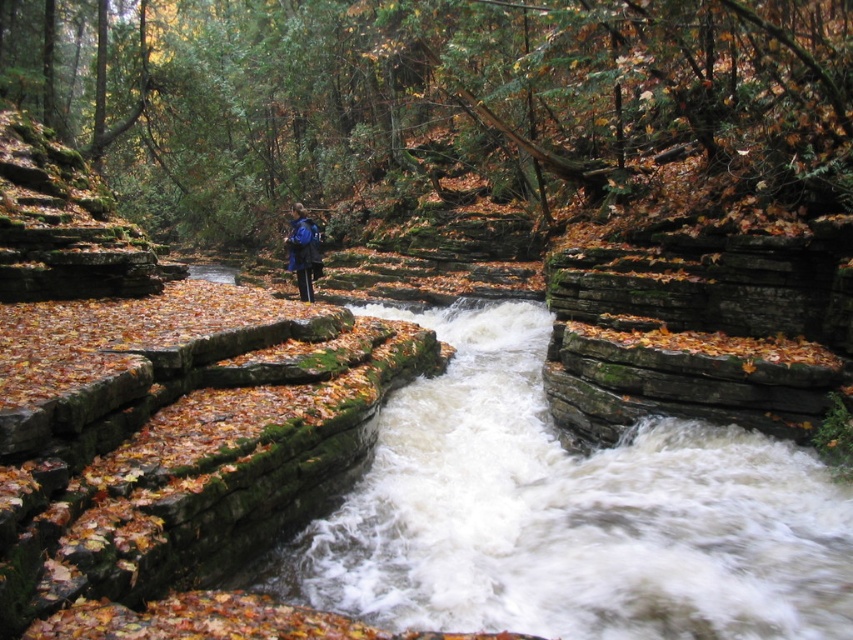
You are standing at the point labeled point (569, 515) in the image. What is the object you are standing on?

The point (569, 515) corresponds to the brown stone stream at center.

You are a hiker trying to cross the stream in the autumn forest scene. You notice two points marked on the stream bed. The first point is at coordinates point [781,506] and the second is at point [308,252]. Which point would be easier to step on first if you are approaching from the top of the image?

Point [781,506] is in front of point [308,252], so it would be easier to step on first as you approach from the top of the image.

You are a hiker who wants to place your blue fabric backpack at center on the ground near the stream. However, you notice there are green mossy rocks at center in the way. Based on the scene, can you place the backpack directly behind the rocks without moving them?

The green mossy rocks at center are in front of the blue fabric backpack at center, so yes, you can place the backpack directly behind the rocks without moving them since the rocks are already positioned in front of the backpack.